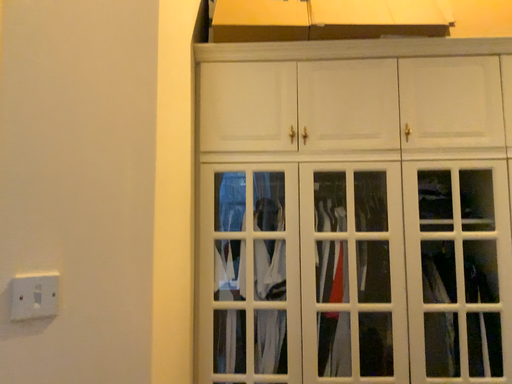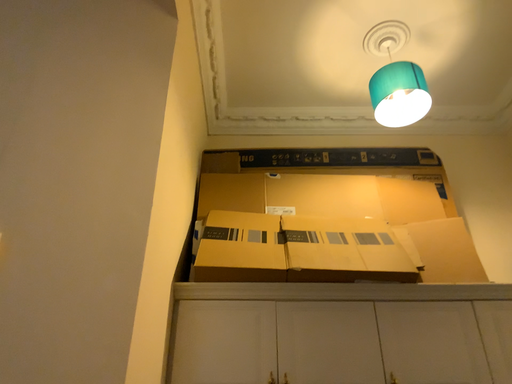
Question: Which way did the camera rotate in the video?

Choices:
 (A) rotated upward
 (B) rotated downward

Answer: (A)